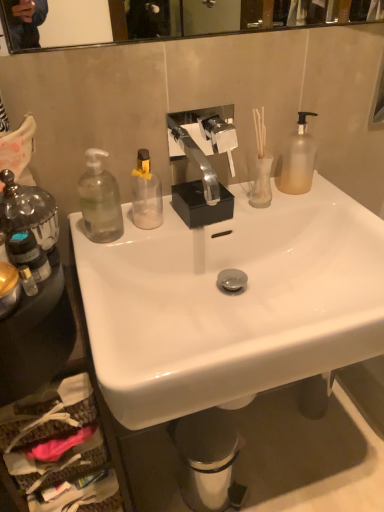
In order to click on transparent glass soap dispenser at left, which is the 2th bottle from right to left in this screenshot , I will do `click(100, 200)`.

In order to face translucent glass vase at upper right, should I rotate leftwards or rightwards?

You should rotate right by 9.264 degrees.

Where is `translucent plastic bottle at left, which is counted as the 4th bottle, starting from the right`? The width and height of the screenshot is (384, 512). translucent plastic bottle at left, which is counted as the 4th bottle, starting from the right is located at coordinates (28, 254).

Identify the location of frosted glass soap dispenser at right, which appears as the fifth bottle when viewed from the left. pyautogui.click(x=297, y=160).

Describe the element at coordinates (297, 160) in the screenshot. I see `frosted glass soap dispenser at right, the first bottle when ordered from right to left` at that location.

Describe the element at coordinates (231, 302) in the screenshot. I see `white glossy sink at center` at that location.

Identify the location of white glossy sink at center. (231, 302).

Image resolution: width=384 pixels, height=512 pixels. What do you see at coordinates (207, 460) in the screenshot?
I see `metallic silver trash can at lower center` at bounding box center [207, 460].

At what (x,y) coordinates should I click in order to perform the action: click on translucent glass bottle at left, placed as the 3th bottle when sorted from right to left. Please return your answer as a coordinate pair (x, y). This screenshot has width=384, height=512. Looking at the image, I should click on (27, 281).

Consider the image. Are frosted glass soap dispenser at right, the first bottle when ordered from right to left, and white glossy sink at center located far from each other?

They are positioned close to each other.

Is frosted glass soap dispenser at right, which appears as the fifth bottle when viewed from the left, further to camera compared to white glossy sink at center?

Yes, frosted glass soap dispenser at right, which appears as the fifth bottle when viewed from the left, is behind white glossy sink at center.

From the image's perspective, would you say frosted glass soap dispenser at right, the first bottle when ordered from right to left, is positioned over white glossy sink at center?

Yes.

Who is bigger, frosted glass soap dispenser at right, the first bottle when ordered from right to left, or white glossy sink at center?

Bigger between the two is white glossy sink at center.

Does point (259, 190) appear closer or farther from the camera than point (52, 211)?

Point (259, 190) is positioned farther from the camera compared to point (52, 211).

From the image's perspective, which is above, translucent glass vase at upper right or clear glass bottle at left, the 1th bottle when ordered from left to right?

From the image's view, translucent glass vase at upper right is above.

Considering the relative sizes of translucent glass vase at upper right and clear glass bottle at left, which is counted as the fifth bottle, starting from the right, in the image provided, is translucent glass vase at upper right bigger than clear glass bottle at left, which is counted as the fifth bottle, starting from the right,?

Incorrect, translucent glass vase at upper right is not larger than clear glass bottle at left, which is counted as the fifth bottle, starting from the right.

Between translucent glass vase at upper right and clear glass bottle at left, which is counted as the fifth bottle, starting from the right, which one has less height?

With less height is translucent glass vase at upper right.

Is translucent glass bottle at left, the third bottle when ordered from left to right, closer to the viewer compared to white glossy sink at center?

No, it is behind white glossy sink at center.

Which object is positioned more to the right, translucent glass bottle at left, placed as the 3th bottle when sorted from right to left, or white glossy sink at center?

Positioned to the right is white glossy sink at center.

Considering the sizes of objects translucent glass bottle at left, placed as the 3th bottle when sorted from right to left, and white glossy sink at center in the image provided, who is smaller, translucent glass bottle at left, placed as the 3th bottle when sorted from right to left, or white glossy sink at center?

translucent glass bottle at left, placed as the 3th bottle when sorted from right to left.

Between translucent glass bottle at left, the third bottle when ordered from left to right, and white glossy sink at center, which one has more height?

white glossy sink at center.

Considering the relative positions of frosted glass soap dispenser at right, the first bottle when ordered from right to left, and translucent plastic bottle at left, which is counted as the 4th bottle, starting from the right, in the image provided, is frosted glass soap dispenser at right, the first bottle when ordered from right to left, to the left of translucent plastic bottle at left, which is counted as the 4th bottle, starting from the right, from the viewer's perspective?

Incorrect, frosted glass soap dispenser at right, the first bottle when ordered from right to left, is not on the left side of translucent plastic bottle at left, which is counted as the 4th bottle, starting from the right.

Does point (275, 183) lie behind point (34, 266)?

Yes, point (275, 183) is behind point (34, 266).

Is frosted glass soap dispenser at right, which appears as the fifth bottle when viewed from the left, next to translucent plastic bottle at left, which is counted as the 4th bottle, starting from the right, and touching it?

No.

Looking at their sizes, would you say frosted glass soap dispenser at right, which appears as the fifth bottle when viewed from the left, is wider or thinner than translucent plastic bottle at left, which is counted as the 4th bottle, starting from the right?

Considering their sizes, frosted glass soap dispenser at right, which appears as the fifth bottle when viewed from the left, looks broader than translucent plastic bottle at left, which is counted as the 4th bottle, starting from the right.

Which object is further away from the camera taking this photo, white glossy sink at center or transparent glass soap dispenser at left, which is the 2th bottle from right to left?

transparent glass soap dispenser at left, which is the 2th bottle from right to left, is further away from the camera.

Can you confirm if white glossy sink at center is shorter than transparent glass soap dispenser at left, acting as the fourth bottle starting from the left?

No, white glossy sink at center is not shorter than transparent glass soap dispenser at left, acting as the fourth bottle starting from the left.

Is white glossy sink at center not within transparent glass soap dispenser at left, which is the 2th bottle from right to left?

Yes.

Is white glossy sink at center to the left of transparent glass soap dispenser at left, which is the 2th bottle from right to left, from the viewer's perspective?

Incorrect, white glossy sink at center is not on the left side of transparent glass soap dispenser at left, which is the 2th bottle from right to left.

Who is smaller, transparent glass soap dispenser at left, acting as the fourth bottle starting from the left, or translucent glass vase at upper right?

translucent glass vase at upper right.

Would you say transparent glass soap dispenser at left, which is the 2th bottle from right to left, is outside translucent glass vase at upper right?

Yes, transparent glass soap dispenser at left, which is the 2th bottle from right to left, is not within translucent glass vase at upper right.

Considering the relative sizes of transparent glass soap dispenser at left, which is the 2th bottle from right to left, and translucent glass vase at upper right in the image provided, is transparent glass soap dispenser at left, which is the 2th bottle from right to left, shorter than translucent glass vase at upper right?

→ No, transparent glass soap dispenser at left, which is the 2th bottle from right to left, is not shorter than translucent glass vase at upper right.

Considering the sizes of transparent glass soap dispenser at left, acting as the fourth bottle starting from the left, and white glossy sink at center in the image, is transparent glass soap dispenser at left, acting as the fourth bottle starting from the left, taller or shorter than white glossy sink at center?

Considering their sizes, transparent glass soap dispenser at left, acting as the fourth bottle starting from the left, has less height than white glossy sink at center.

Looking at this image, does transparent glass soap dispenser at left, acting as the fourth bottle starting from the left, touch white glossy sink at center?

transparent glass soap dispenser at left, acting as the fourth bottle starting from the left, and white glossy sink at center are not in contact.

Locate an element on the screen. sink that appears below the transparent glass soap dispenser at left, acting as the fourth bottle starting from the left (from a real-world perspective) is located at coordinates tap(231, 302).

Locate an element on the screen. sink in front of the frosted glass soap dispenser at right, the first bottle when ordered from right to left is located at coordinates (231, 302).

You are a GUI agent. You are given a task and a screenshot of the screen. Output one action in this format:
    pyautogui.click(x=<x>, y=<y>)
    Task: Click on the bottle that is the 5th one above the translucent glass vase at upper right (from a real-world perspective)
    Image resolution: width=384 pixels, height=512 pixels.
    Given the screenshot: What is the action you would take?
    pyautogui.click(x=28, y=211)

Which object lies further to the anchor point translucent glass vase at upper right, translucent plastic bottle at left, which is counted as the 4th bottle, starting from the right, or transparent glass soap dispenser at left, which is the 2th bottle from right to left?

Based on the image, translucent plastic bottle at left, which is counted as the 4th bottle, starting from the right, appears to be further to translucent glass vase at upper right.

When comparing their distances from translucent plastic bottle at left, which is counted as the 4th bottle, starting from the right, does translucent glass bottle at left, placed as the 3th bottle when sorted from right to left, or white glossy sink at center seem further?

Among the two, white glossy sink at center is located further to translucent plastic bottle at left, which is counted as the 4th bottle, starting from the right.

Looking at the image, which one is located further to frosted glass soap dispenser at right, which appears as the fifth bottle when viewed from the left, metallic silver trash can at lower center or translucent glass vase at upper right?

metallic silver trash can at lower center is further to frosted glass soap dispenser at right, which appears as the fifth bottle when viewed from the left.

Based on their spatial positions, is transparent glass soap dispenser at left, acting as the fourth bottle starting from the left, or translucent plastic bottle at left, which is counted as the 4th bottle, starting from the right, further from metallic silver trash can at lower center?

translucent plastic bottle at left, which is counted as the 4th bottle, starting from the right.

Consider the image. When comparing their distances from translucent glass vase at upper right, does clear glass bottle at left, the 1th bottle when ordered from left to right, or frosted glass soap dispenser at right, which appears as the fifth bottle when viewed from the left, seem closer?

Based on the image, frosted glass soap dispenser at right, which appears as the fifth bottle when viewed from the left, appears to be nearer to translucent glass vase at upper right.

Based on their spatial positions, is translucent plastic bottle at left, which is counted as the 4th bottle, starting from the right, or metallic silver trash can at lower center closer to translucent glass vase at upper right?

translucent plastic bottle at left, which is counted as the 4th bottle, starting from the right, is closer to translucent glass vase at upper right.

From the image, which object appears to be nearer to clear glass bottle at left, the 1th bottle when ordered from left to right, translucent glass bottle at left, the third bottle when ordered from left to right, or transparent glass soap dispenser at left, acting as the fourth bottle starting from the left?

The object closer to clear glass bottle at left, the 1th bottle when ordered from left to right, is translucent glass bottle at left, the third bottle when ordered from left to right.

Which object lies further to the anchor point frosted glass soap dispenser at right, the first bottle when ordered from right to left, transparent glass soap dispenser at left, acting as the fourth bottle starting from the left, or white glossy sink at center?

Based on the image, transparent glass soap dispenser at left, acting as the fourth bottle starting from the left, appears to be further to frosted glass soap dispenser at right, the first bottle when ordered from right to left.

Identify the location of toiletries between transparent glass soap dispenser at left, which is the 2th bottle from right to left, and frosted glass soap dispenser at right, the first bottle when ordered from right to left. (262, 183).

In order to click on sink between translucent plastic bottle at left, which is counted as the 4th bottle, starting from the right, and frosted glass soap dispenser at right, the first bottle when ordered from right to left, from left to right in this screenshot , I will do 231,302.

Where is `sink between frosted glass soap dispenser at right, which appears as the fifth bottle when viewed from the left, and metallic silver trash can at lower center vertically`? The width and height of the screenshot is (384, 512). sink between frosted glass soap dispenser at right, which appears as the fifth bottle when viewed from the left, and metallic silver trash can at lower center vertically is located at coordinates (231, 302).

The height and width of the screenshot is (512, 384). I want to click on sink between translucent glass bottle at left, placed as the 3th bottle when sorted from right to left, and translucent glass vase at upper right, so click(x=231, y=302).